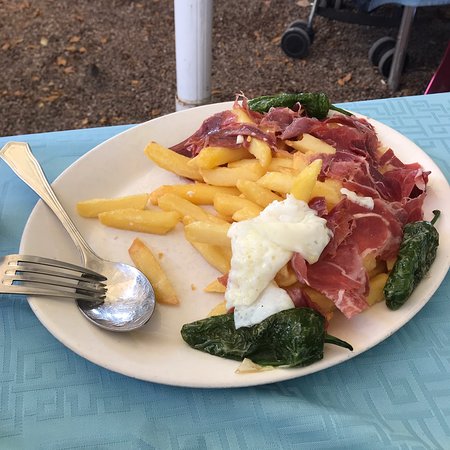
The height and width of the screenshot is (450, 450). Identify the location of rim marking in plate. (138, 177), (91, 233), (157, 348).